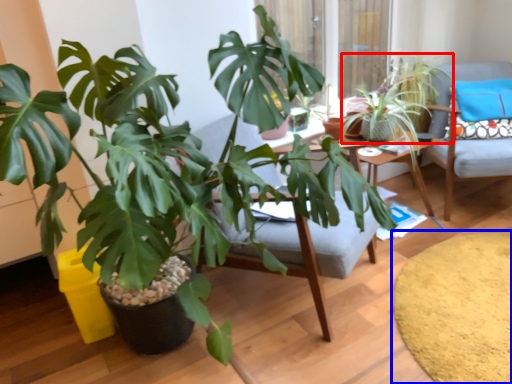
Question: Which object is further to the camera taking this photo, houseplant (highlighted by a red box) or mat (highlighted by a blue box)?

Choices:
 (A) houseplant
 (B) mat

Answer: (A)